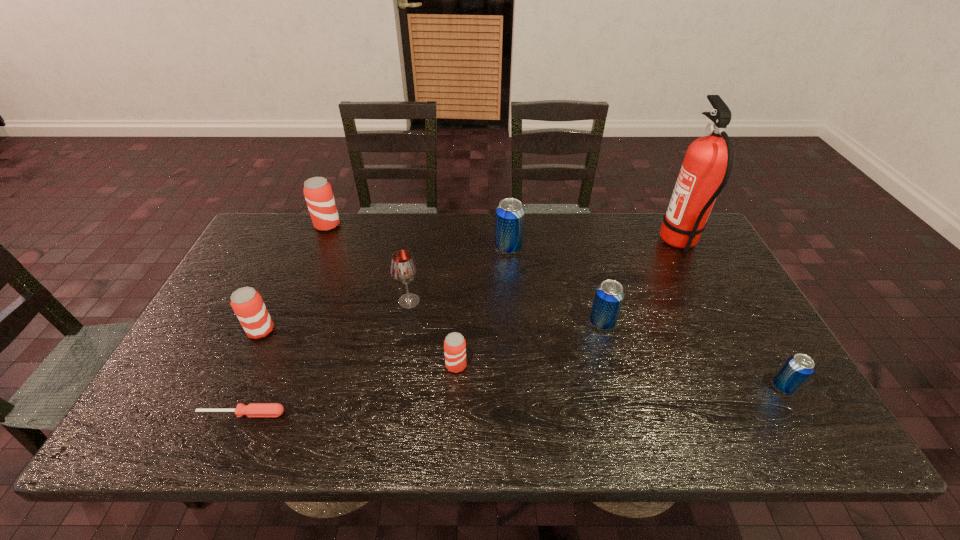
The image size is (960, 540). In order to click on free region that satisfies the following two spatial constraints: 1. on the handle side of the red fire extinguisher; 2. on the front side of the shortest object in this screenshot , I will do `click(770, 414)`.

I want to click on free space that satisfies the following two spatial constraints: 1. on the front side of the third object from right to left; 2. on the right side of the smallest blue beer can, so click(x=619, y=387).

You are a GUI agent. You are given a task and a screenshot of the screen. Output one action in this format:
    pyautogui.click(x=<x>, y=<y>)
    Task: Click on the vacant region that satisfies the following two spatial constraints: 1. on the front side of the rightmost orange beer can; 2. on the right side of the farthest beer can
    The image size is (960, 540).
    Given the screenshot: What is the action you would take?
    pyautogui.click(x=268, y=366)